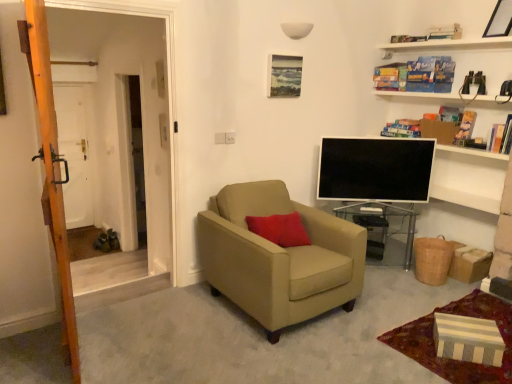
Question: Do you think transparent glass table at center is within white glossy tv at center, or outside of it?

Choices:
 (A) inside
 (B) outside

Answer: (B)

Question: From a real-world perspective, is transparent glass table at center above or below white glossy tv at center?

Choices:
 (A) above
 (B) below

Answer: (B)

Question: Which is nearer to the hardcover book at upper right, the 3th book positioned from the bottom?

Choices:
 (A) hardcover book at upper right, acting as the 2th book starting from the bottom
 (B) hardcover book at upper center, the fifth book when ordered from bottom to top
 (C) wooden picture frame at upper right, marked as the 1th picture frame in a right-to-left arrangement
 (D) transparent glass table at center
 (E) matte wooden picture frame at upper center, positioned as the 2th picture frame in front-to-back order

Answer: (A)

Question: Which object is the closest to the white matte door at left?

Choices:
 (A) hardcover book at upper center, the fifth book when ordered from bottom to top
 (B) hardcover book at upper right, which is the fifth book in top-to-bottom order
 (C) transparent glass table at center
 (D) hardcover book at upper right, the 3th book positioned from the bottom
 (E) beige fabric armchair at center

Answer: (E)